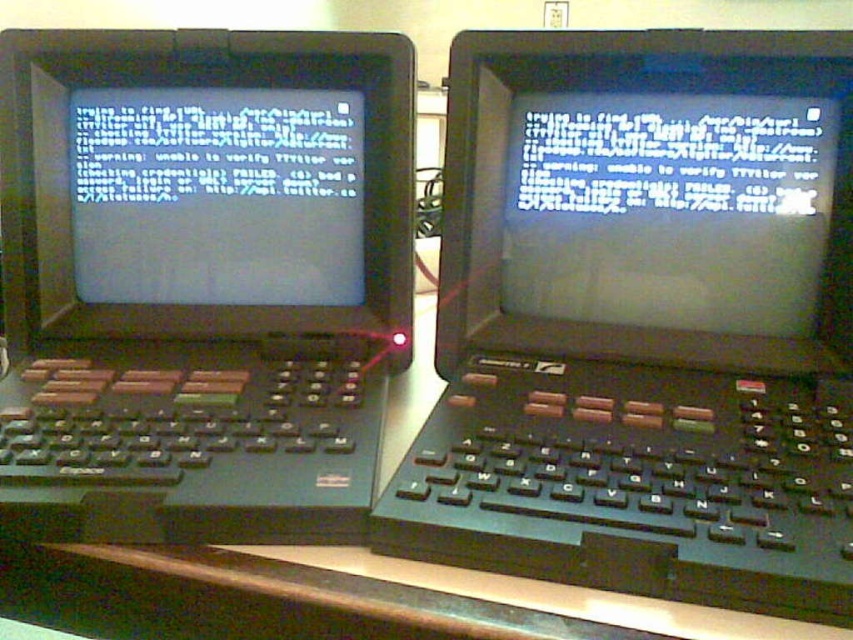
Between point (177, 144) and point (405, 577), which one is positioned in front?

Point (405, 577) is more forward.

Is white matte monitor at center wider than wooden table at center?

In fact, white matte monitor at center might be narrower than wooden table at center.

At what (x,y) coordinates should I click in order to perform the action: click on white matte monitor at center. Please return your answer as a coordinate pair (x, y). The image size is (853, 640). Looking at the image, I should click on (218, 195).

The image size is (853, 640). Find the location of `white matte monitor at center`. white matte monitor at center is located at coordinates (218, 195).

Can you confirm if black plastic laptop at center is shorter than wooden table at center?

Incorrect, black plastic laptop at center's height does not fall short of wooden table at center's.

Between black plastic laptop at center and wooden table at center, which one is positioned lower?

Positioned lower is wooden table at center.

Who is more distant from viewer, (538, 323) or (677, 604)?

The point (538, 323) is behind.

The width and height of the screenshot is (853, 640). I want to click on black plastic laptop at center, so click(x=643, y=320).

The image size is (853, 640). Find the location of `black plastic computer at left`. black plastic computer at left is located at coordinates (200, 280).

Is black plastic computer at left to the left of white matte monitor at center from the viewer's perspective?

No, black plastic computer at left is not to the left of white matte monitor at center.

Who is more forward, (44, 333) or (314, 248)?

Point (44, 333) is more forward.

Locate an element on the screen. The image size is (853, 640). black plastic computer at left is located at coordinates click(x=200, y=280).